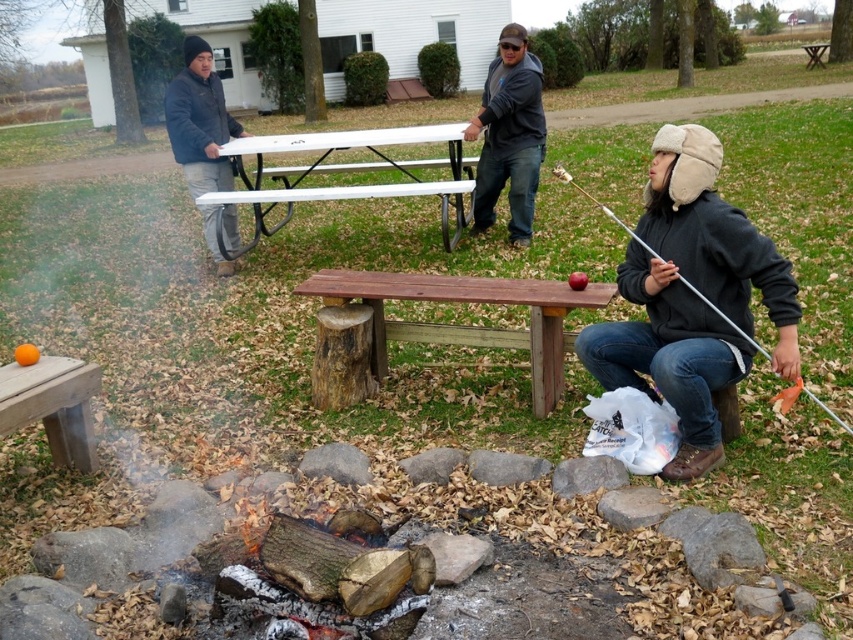
You are planning to set up a tent in this scene. You have a large tent that requires a space larger than the dark gray jacket at left. Can you place it where the wooden picnic table at lower left is located?

The dark gray jacket at left is bigger than the wooden picnic table at lower left, so the space where the wooden picnic table at lower left is located is smaller than required for the tent. Therefore, you cannot place the tent there.

What is located at the coordinates point [509,134]?

The dark gray hoodie at center is located at point [509,134].

You are standing at the edge of the campfire scene. You need to retrieve the metallic silver fishing pole at lower right. Is the dark gray hoodie at center blocking your direct path to it?

The dark gray hoodie at center is in front of the metallic silver fishing pole at lower right, so yes, the dark gray hoodie at center is blocking your path to the metallic silver fishing pole at lower right.